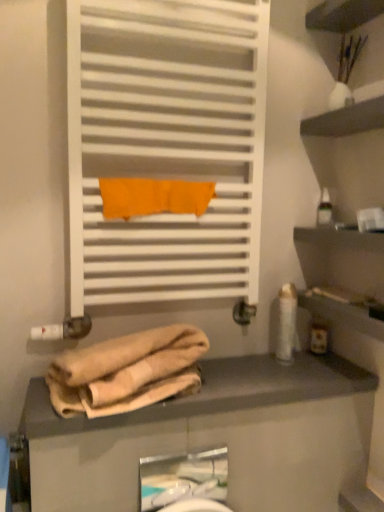
In order to click on spots to the right of white glossy lotion at right, the 2th toiletry positioned from the bottom in this screenshot , I will do `click(325, 368)`.